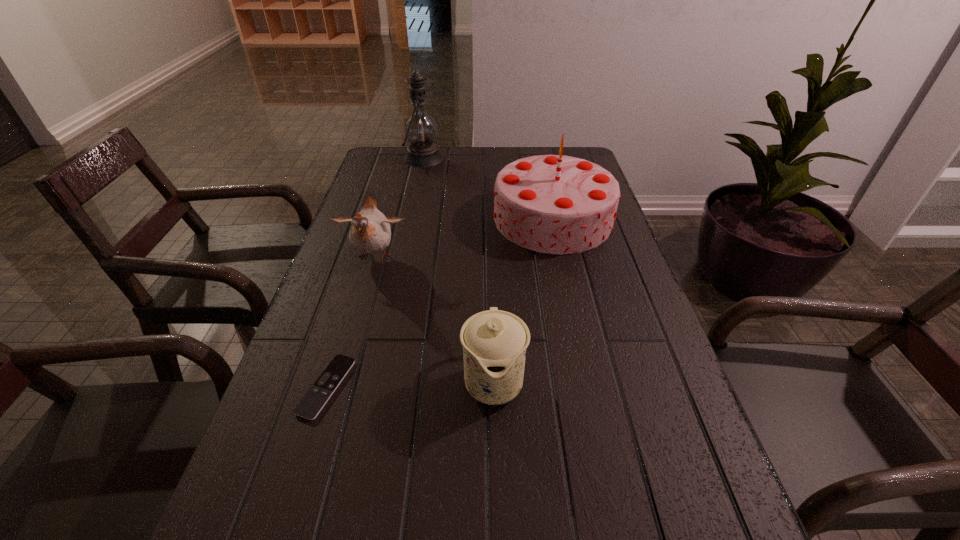
Where is `object located in the far edge section of the desktop`? object located in the far edge section of the desktop is located at coordinates (420, 129).

At what (x,y) coordinates should I click in order to perform the action: click on oil lamp present at the left edge. Please return your answer as a coordinate pair (x, y). The height and width of the screenshot is (540, 960). Looking at the image, I should click on 420,129.

This screenshot has height=540, width=960. I want to click on bird situated at the left edge, so click(370, 232).

Locate an element on the screen. This screenshot has width=960, height=540. remote control located at the left edge is located at coordinates (309, 407).

Where is `object at the right edge`? object at the right edge is located at coordinates (556, 204).

The height and width of the screenshot is (540, 960). In order to click on object at the far left corner in this screenshot , I will do `click(420, 129)`.

Find the location of a particular element. This screenshot has width=960, height=540. vacant area at the far edge is located at coordinates (463, 167).

The image size is (960, 540). What are the coordinates of `vacant space at the left edge of the desktop` in the screenshot? It's located at click(x=332, y=291).

In the image, there is a desktop. Where is `vacant space at the right edge`? vacant space at the right edge is located at coordinates (613, 268).

Where is `free area in between the remote control and the chinaware`? The image size is (960, 540). free area in between the remote control and the chinaware is located at coordinates (410, 384).